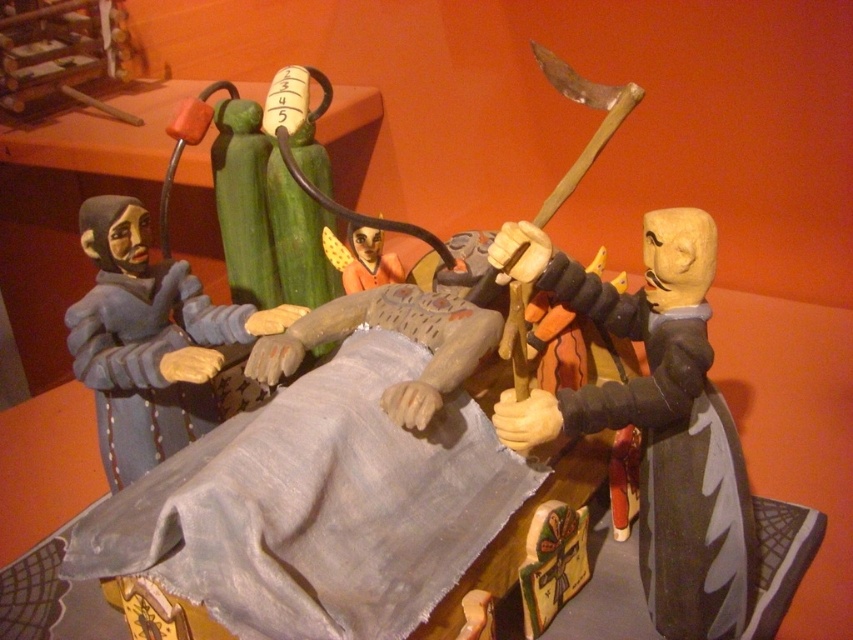
Question: Which of the following is the farthest from the observer?

Choices:
 (A) (345, 260)
 (B) (695, 314)

Answer: (A)

Question: Among these points, which one is nearest to the camera?

Choices:
 (A) (80, 214)
 (B) (396, 381)
 (C) (381, 243)

Answer: (B)

Question: Is matte gray figure at left to the right of orange fabric doll at center from the viewer's perspective?

Choices:
 (A) yes
 (B) no

Answer: (B)

Question: Which point is farther to the camera?

Choices:
 (A) orange fabric doll at center
 (B) wooden figure at right
 (C) smooth gray fabric at center

Answer: (A)

Question: Does wooden figure at right have a larger size compared to orange fabric doll at center?

Choices:
 (A) no
 (B) yes

Answer: (B)

Question: Can you confirm if matte gray figure at left is positioned above orange fabric doll at center?

Choices:
 (A) no
 (B) yes

Answer: (A)